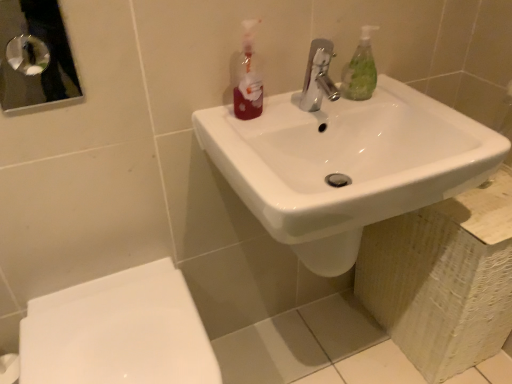
Identify the location of free space to the right of polished chrome faucet at center. The image size is (512, 384). (390, 108).